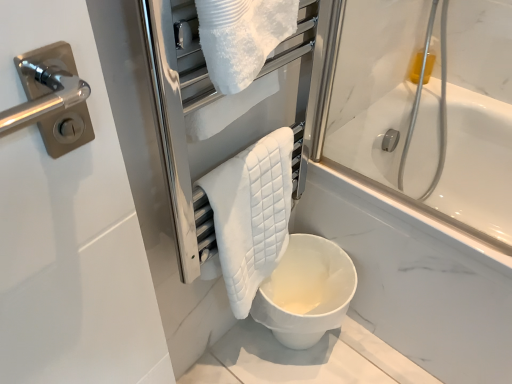
Where is `white quilted towel at center`? The image size is (512, 384). white quilted towel at center is located at coordinates (180, 122).

Image resolution: width=512 pixels, height=384 pixels. What do you see at coordinates (251, 214) in the screenshot?
I see `white quilted towel at center` at bounding box center [251, 214].

The image size is (512, 384). Identify the location of white quilted towel at center. (x=180, y=122).

Who is bigger, white matte toilet at lower center or white quilted towel at center?

With larger size is white matte toilet at lower center.

Is white matte toilet at lower center to the left of white quilted towel at center from the viewer's perspective?

Incorrect, white matte toilet at lower center is not on the left side of white quilted towel at center.

Does white matte toilet at lower center turn towards white quilted towel at center?

No, white matte toilet at lower center is not oriented towards white quilted towel at center.

Which of these two, white quilted towel at center or white matte toilet at lower center, stands shorter?

white matte toilet at lower center is shorter.

The image size is (512, 384). What are the coordinates of `toilet that appears below the white quilted towel at center (from the image's perspective)` in the screenshot? It's located at (306, 291).

Is point (198, 201) in front of point (274, 317)?

Yes, it is in front of point (274, 317).

Between white quilted towel at center and white matte toilet at lower center, which one is positioned behind?

Positioned behind is white matte toilet at lower center.

How different are the orientations of white quilted towel at center and white quilted towel at center in degrees?

The angular difference between white quilted towel at center and white quilted towel at center is 0.00589 degrees.

Considering the relative positions of white quilted towel at center and white quilted towel at center in the image provided, is white quilted towel at center to the right of white quilted towel at center from the viewer's perspective?

Indeed, white quilted towel at center is positioned on the right side of white quilted towel at center.

Locate an element on the screen. The width and height of the screenshot is (512, 384). bath towel behind the white quilted towel at center is located at coordinates (251, 214).

Considering the sizes of objects white quilted towel at center and white quilted towel at center in the image provided, who is wider, white quilted towel at center or white quilted towel at center?

white quilted towel at center.

Looking at this image, is white quilted towel at center turned away from white quilted towel at center?

Yes, white quilted towel at center is at the back of white quilted towel at center.

Based on the photo, is white quilted towel at center completely or partially outside of white quilted towel at center?

Actually, white quilted towel at center is within white quilted towel at center.

From the image's perspective, between white quilted towel at center and white quilted towel at center, which one is located above?

white quilted towel at center is shown above in the image.

Considering the positions of objects white quilted towel at center and white quilted towel at center in the image provided, who is behind, white quilted towel at center or white quilted towel at center?

Positioned behind is white quilted towel at center.

In the scene shown: From a real-world perspective, is white matte toilet at lower center located beneath white quilted towel at center?

Correct, in the physical world, white matte toilet at lower center is lower than white quilted towel at center.

Locate an element on the screen. toilet below the white quilted towel at center (from the image's perspective) is located at coordinates (306, 291).

Based on the photo, considering the sizes of white matte toilet at lower center and white quilted towel at center in the image, is white matte toilet at lower center taller or shorter than white quilted towel at center?

In the image, white matte toilet at lower center appears to be shorter than white quilted towel at center.

Could you tell me if white matte toilet at lower center is turned towards white quilted towel at center?

No, white matte toilet at lower center is not turned towards white quilted towel at center.

Are white quilted towel at center and white matte toilet at lower center located far from each other?

No, there isn't a large distance between white quilted towel at center and white matte toilet at lower center.

What are the coordinates of `toilet that is under the white quilted towel at center (from a real-world perspective)` in the screenshot? It's located at [x=306, y=291].

Is white quilted towel at center taller than white matte toilet at lower center?

Yes, white quilted towel at center is taller than white matte toilet at lower center.

From the image's perspective, between white quilted towel at center and white matte toilet at lower center, which one is located above?

white quilted towel at center is shown above in the image.

What are the coordinates of `bath towel in front of the white matte toilet at lower center` in the screenshot? It's located at (251, 214).

This screenshot has width=512, height=384. I want to click on screen door lying above the white matte toilet at lower center (from the image's perspective), so click(180, 122).

From the image, which object appears to be nearer to white matte toilet at lower center, white quilted towel at center or white quilted towel at center?

white quilted towel at center.

When comparing their distances from white quilted towel at center, does white matte toilet at lower center or white quilted towel at center seem closer?

Among the two, white quilted towel at center is located nearer to white quilted towel at center.

From the picture: From the image, which object appears to be nearer to white quilted towel at center, white quilted towel at center or white matte toilet at lower center?

Based on the image, white quilted towel at center appears to be nearer to white quilted towel at center.

In the scene shown: From the image, which object appears to be nearer to white quilted towel at center, white quilted towel at center or white matte toilet at lower center?

Among the two, white quilted towel at center is located nearer to white quilted towel at center.

When comparing their distances from white matte toilet at lower center, does white quilted towel at center or white quilted towel at center seem closer?

Based on the image, white quilted towel at center appears to be nearer to white matte toilet at lower center.

Based on their spatial positions, is white matte toilet at lower center or white quilted towel at center closer to white quilted towel at center?

Among the two, white quilted towel at center is located nearer to white quilted towel at center.

In order to click on bath towel positioned between white quilted towel at center and white matte toilet at lower center from near to far in this screenshot , I will do `click(251, 214)`.